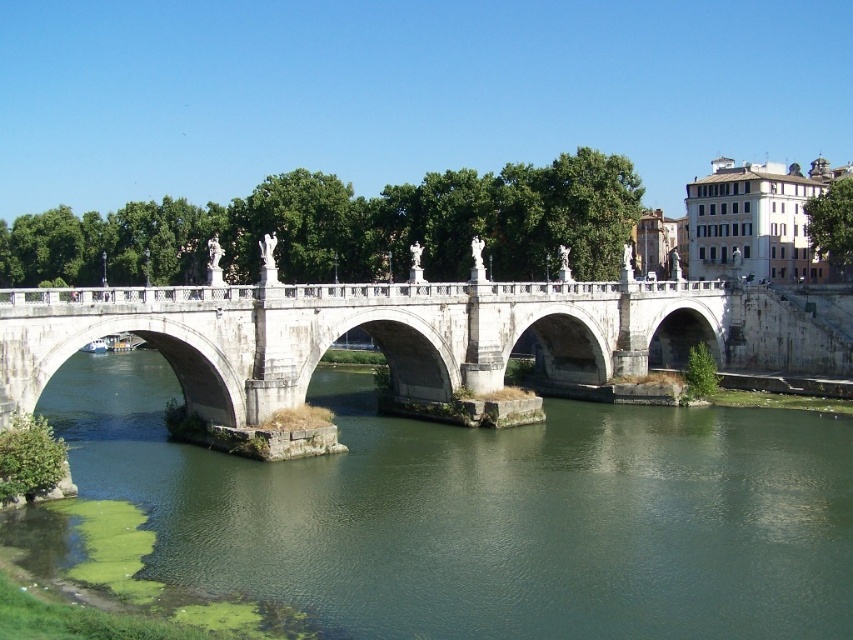
You are a photographer planning to capture the white stone bridge at center and the green algae water at lower left in a single frame. Based on the scene, which object will occupy a larger portion of the photo?

The white stone bridge at center occupies a larger portion of the photo than the green algae water at lower left because the green algae water at lower left occupies less space than white stone bridge at center.

You are a tourist standing on the white stone bridge at center, looking towards the green algae water at lower left. Which object is closer to the ground level?

The green algae water at lower left is closer to the ground level because it is shorter than the white stone bridge at center.